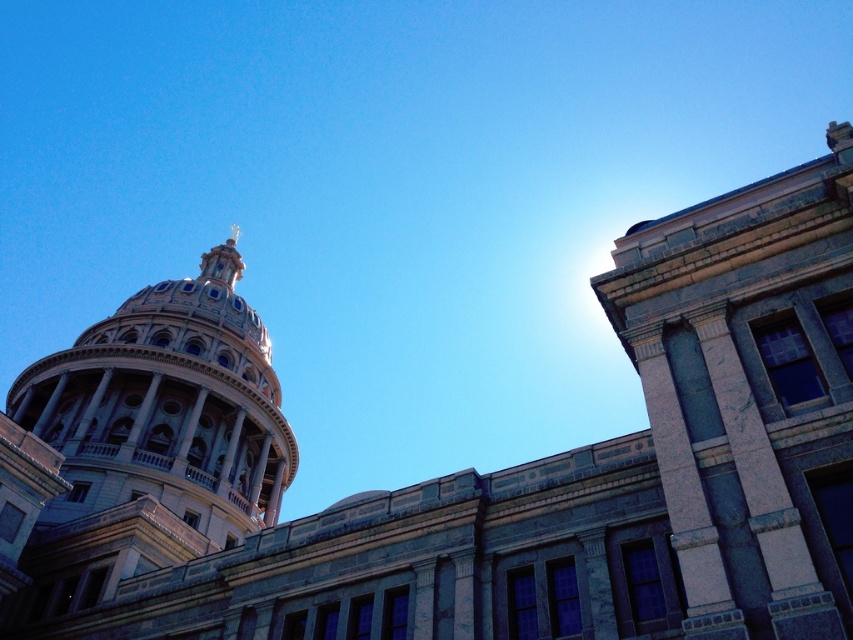
Does gray stone building at upper right come behind gold metallic spire at upper center?

No, gray stone building at upper right is in front of gold metallic spire at upper center.

Is gray stone building at upper right in front of gold metallic spire at upper center?

That is True.

Measure the distance between point (782, 356) and camera.

Point (782, 356) is 29.75 meters from camera.

Identify the location of gray stone building at upper right. The height and width of the screenshot is (640, 853). (750, 394).

How much distance is there between gray stone building at upper right and marble dome at upper left?

gray stone building at upper right and marble dome at upper left are 56.47 meters apart from each other.

Is gray stone building at upper right to the left of marble dome at upper left from the viewer's perspective?

Incorrect, gray stone building at upper right is not on the left side of marble dome at upper left.

Who is more distant from viewer, [721,529] or [173,296]?

The point [173,296] is more distant.

Where is `gray stone building at upper right`? gray stone building at upper right is located at coordinates click(x=750, y=394).

Which is more to the left, marble dome at upper left or gold metallic spire at upper center?

From the viewer's perspective, gold metallic spire at upper center appears more on the left side.

Is marble dome at upper left thinner than gold metallic spire at upper center?

No, marble dome at upper left is not thinner than gold metallic spire at upper center.

Is point (33, 387) less distant than point (236, 230)?

That is True.

Where is `marble dome at upper left`? marble dome at upper left is located at coordinates (144, 449).